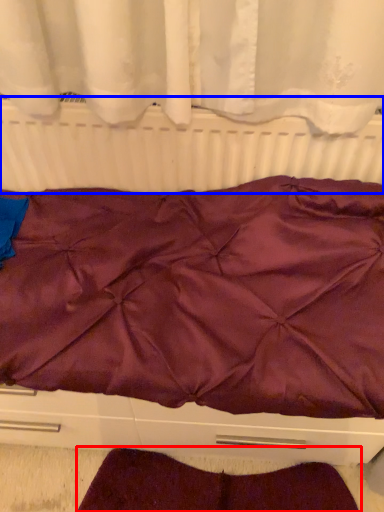
Question: Which point is further to the camera, blanket (highlighted by a red box) or radiator (highlighted by a blue box)?

Choices:
 (A) blanket
 (B) radiator

Answer: (A)